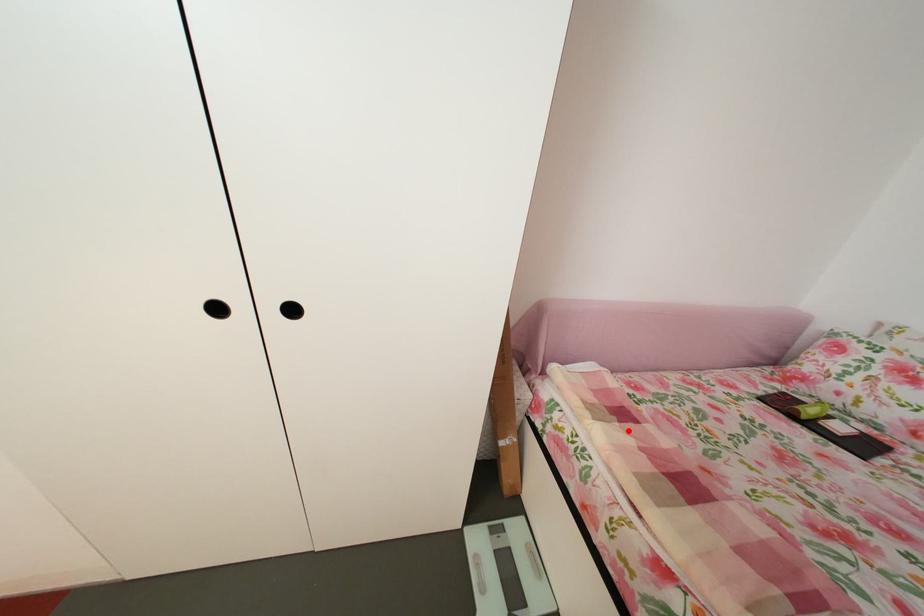
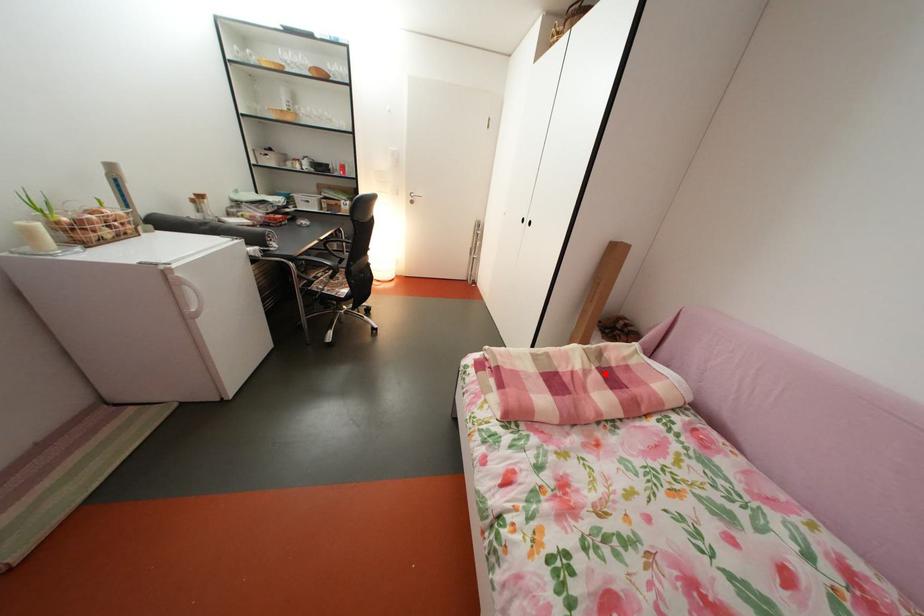
I am providing you with two images of the same scene from different viewpoints. A red point is marked on the first image and another point is marked on the second image. Is the red point in image1 aligned with the point shown in image2?

Yes